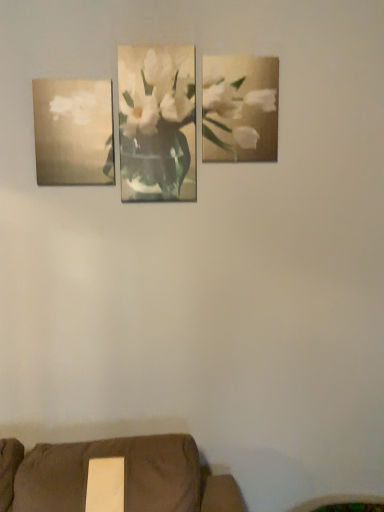
Question: From their relative heights in the image, would you say metallic gold painting at upper right, the 2th picture frame when ordered from left to right, is taller or shorter than matte gold painting at left, the second picture frame when ordered from right to left?

Choices:
 (A) short
 (B) tall

Answer: (B)

Question: In terms of width, does metallic gold painting at upper right, the 2th picture frame when ordered from left to right, look wider or thinner when compared to matte gold painting at left, the second picture frame when ordered from right to left?

Choices:
 (A) thin
 (B) wide

Answer: (A)

Question: Considering the real-world distances, which object is farthest from the white matte flower at center?

Choices:
 (A) matte gold painting at left, the 1th picture frame viewed from the left
 (B) metallic gold painting at upper right, the 2th picture frame when ordered from left to right

Answer: (A)

Question: Estimate the real-world distances between objects in this image. Which object is farther from the matte gold painting at left, the 1th picture frame viewed from the left?

Choices:
 (A) metallic gold painting at upper right, the first picture frame from the right
 (B) white matte flower at center

Answer: (A)